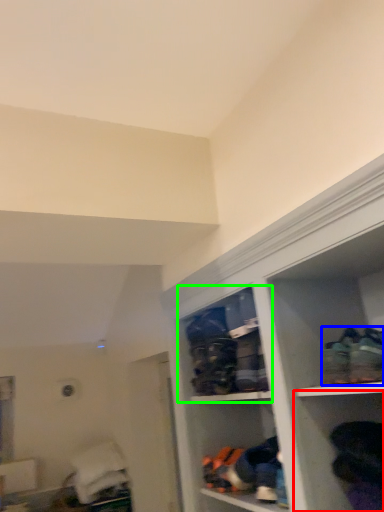
Question: Which object is the closest to the shelf (highlighted by a red box)? Choose among these: footwear (highlighted by a blue box) or cabinet (highlighted by a green box).

Choices:
 (A) footwear
 (B) cabinet

Answer: (A)